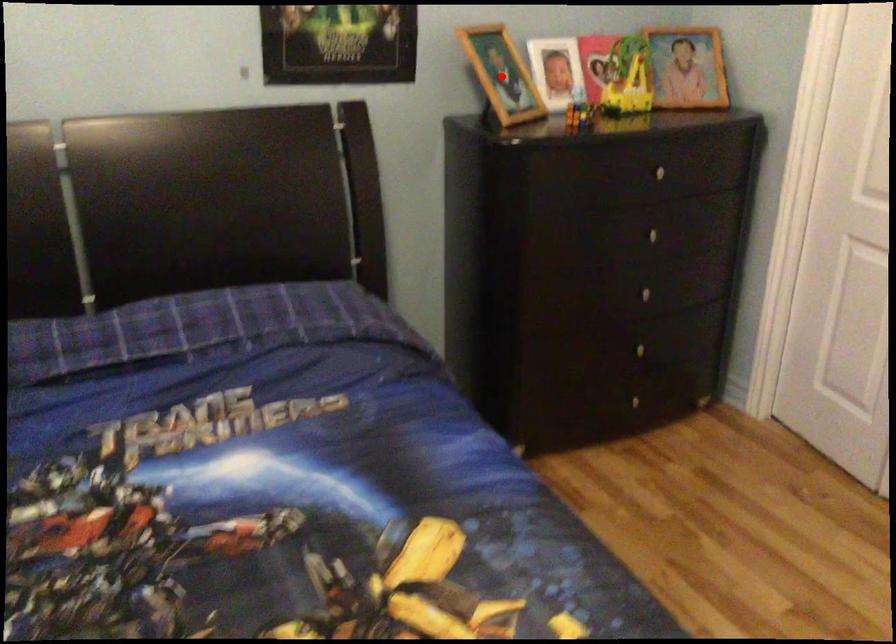
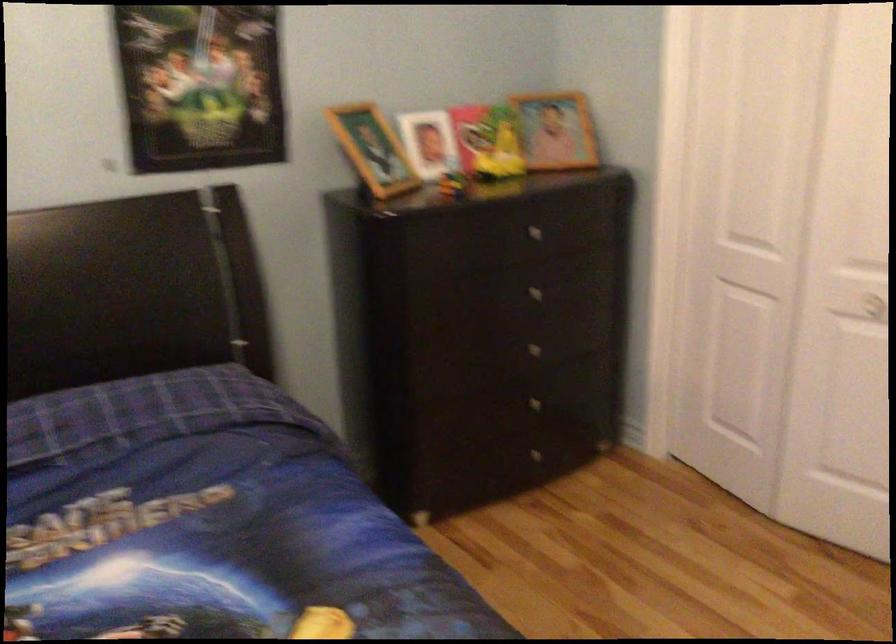
Where in the second image is the point corresponding to the highlighted location from the first image?

(373, 149)